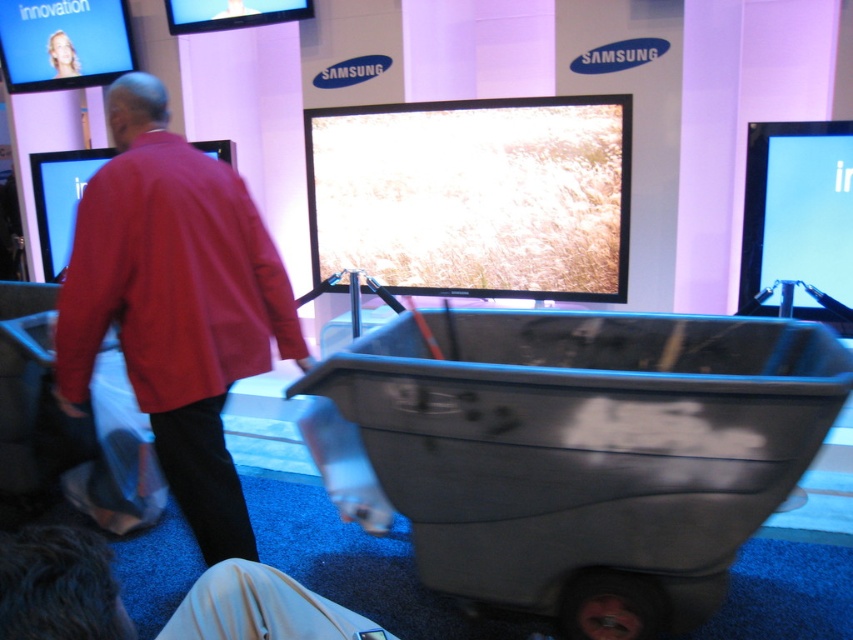
Who is shorter, gray plastic cart at center or red cotton shirt at center?

Standing shorter between the two is gray plastic cart at center.

Between point (512, 444) and point (248, 237), which one is positioned behind?

Point (248, 237)

Where is `gray plastic cart at center`? gray plastic cart at center is located at coordinates (587, 451).